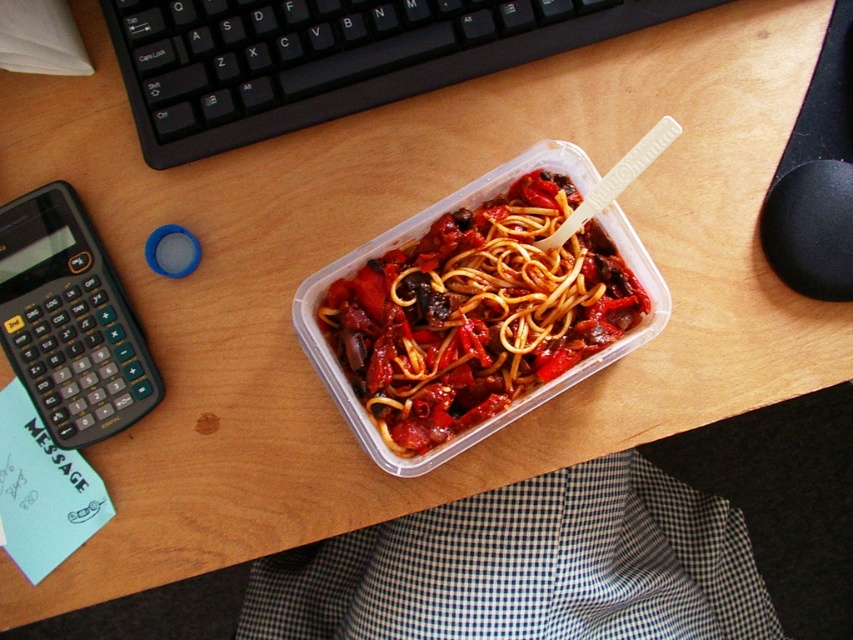
Question: Is black plastic keyboard at upper center above black plastic calculator at left?

Choices:
 (A) yes
 (B) no

Answer: (A)

Question: Which object is closer to the camera taking this photo?

Choices:
 (A) black plastic keyboard at upper center
 (B) black plastic calculator at left

Answer: (B)

Question: Which point is farther from the camera taking this photo?

Choices:
 (A) (242, 68)
 (B) (146, 378)

Answer: (A)

Question: Is black plastic keyboard at upper center smaller than translucent plastic container at center?

Choices:
 (A) no
 (B) yes

Answer: (B)

Question: Which point is farther to the camera?

Choices:
 (A) (70, 433)
 (B) (550, 282)

Answer: (A)

Question: Is black plastic keyboard at upper center in front of translucent plastic container at center?

Choices:
 (A) no
 (B) yes

Answer: (A)